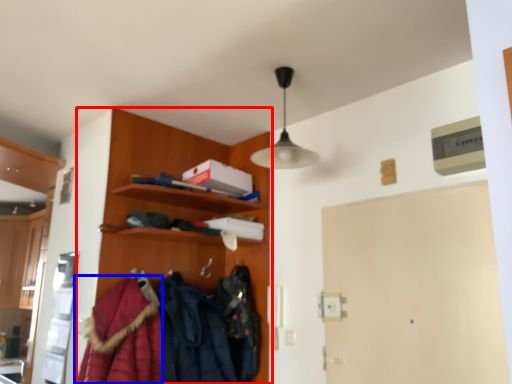
Question: Which object appears closest to the camera in this image, dresser (highlighted by a red box) or cloak (highlighted by a blue box)?

Choices:
 (A) dresser
 (B) cloak

Answer: (B)